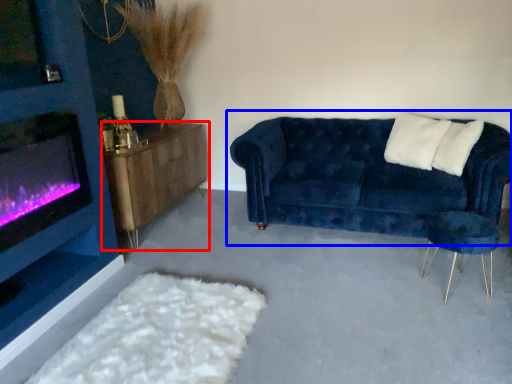
Question: Which object appears closest to the camera in this image, table (highlighted by a red box) or studio couch (highlighted by a blue box)?

Choices:
 (A) table
 (B) studio couch

Answer: (B)